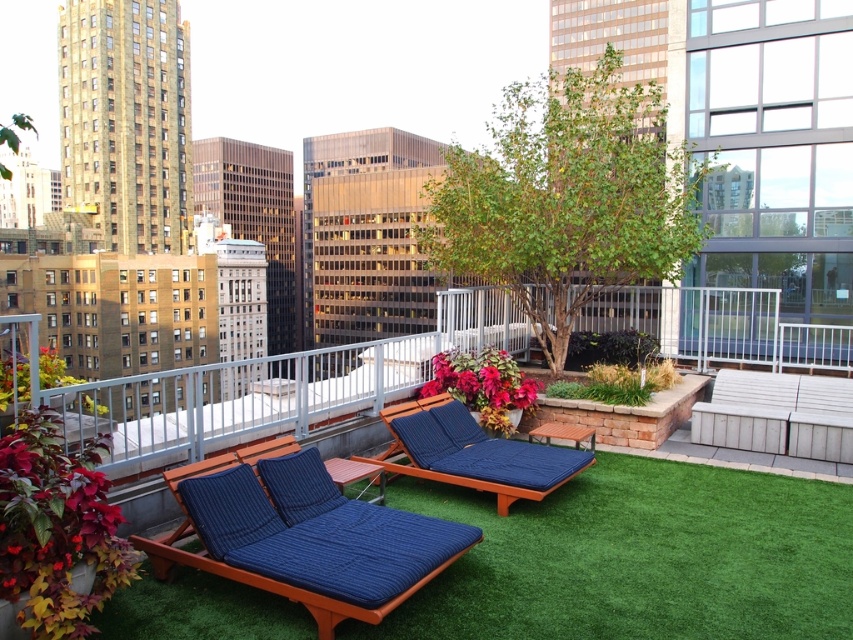
Can you confirm if green artificial turf at center is positioned to the right of matte blue cushioned lounge chair at center?

Indeed, green artificial turf at center is positioned on the right side of matte blue cushioned lounge chair at center.

Can you confirm if green artificial turf at center is smaller than matte blue cushioned lounge chair at center?

Indeed, green artificial turf at center has a smaller size compared to matte blue cushioned lounge chair at center.

Is point (509, 580) farther from camera compared to point (463, 534)?

Yes, it is.

This screenshot has height=640, width=853. Find the location of `green artificial turf at center`. green artificial turf at center is located at coordinates (637, 557).

Between matte blue cushioned lounge chair at center and navy blue quilted cushion at center, which one has more height?

navy blue quilted cushion at center is taller.

Who is more forward, [291,508] or [421,413]?

Point [291,508]

What do you see at coordinates (306, 540) in the screenshot? The image size is (853, 640). I see `matte blue cushioned lounge chair at center` at bounding box center [306, 540].

Where is `matte blue cushioned lounge chair at center`? This screenshot has width=853, height=640. matte blue cushioned lounge chair at center is located at coordinates tap(306, 540).

Does navy blue quilted cushion at center have a greater width compared to white wood bench at lower right?

No.

Who is shorter, navy blue quilted cushion at center or white wood bench at lower right?

white wood bench at lower right is shorter.

Is point (422, 460) in front of point (750, 422)?

Yes, it is.

Where is `navy blue quilted cushion at center`? navy blue quilted cushion at center is located at coordinates (474, 452).